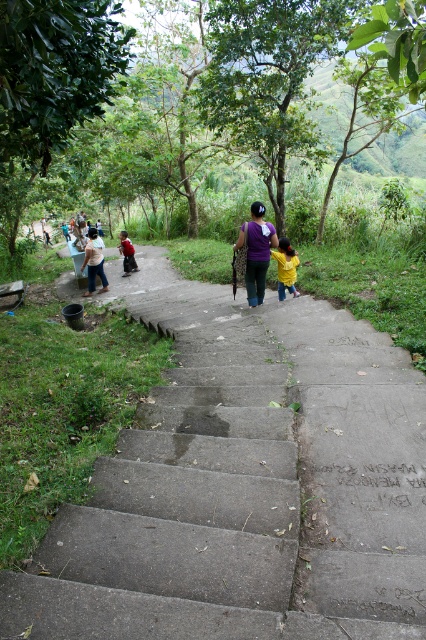
Question: Does purple fabric at center come behind yellow matte jacket at center?

Choices:
 (A) yes
 (B) no

Answer: (B)

Question: Which object is closer to the camera taking this photo?

Choices:
 (A) yellow matte jacket at center
 (B) light brown woven bag at left
 (C) purple fabric at center

Answer: (C)

Question: Estimate the real-world distances between objects in this image. Which object is closer to the purple fabric at center?

Choices:
 (A) concrete stairs at center
 (B) light brown woven bag at left
 (C) yellow matte jacket at center

Answer: (C)

Question: Is yellow matte jacket at center smaller than light brown woven bag at left?

Choices:
 (A) yes
 (B) no

Answer: (A)

Question: Does concrete stairs at center have a greater width compared to red fabric shirt at lower left?

Choices:
 (A) yes
 (B) no

Answer: (B)

Question: Which object appears closest to the camera in this image?

Choices:
 (A) red fabric shirt at lower left
 (B) light brown woven bag at left

Answer: (B)